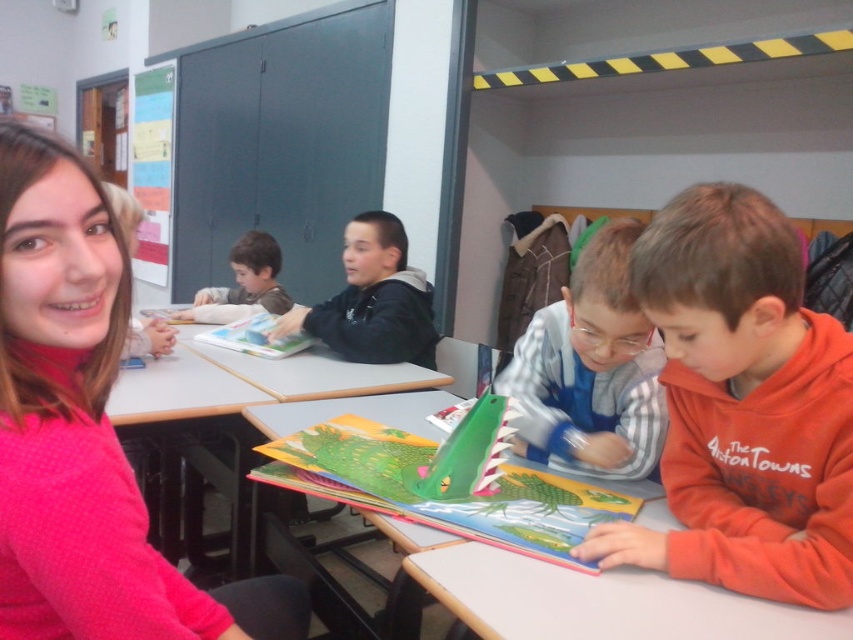
Question: Which point is farther to the camera?

Choices:
 (A) orange fleece sweatshirt at lower right
 (B) light brown hoodie at center
 (C) pink fleece sweater at upper left

Answer: (B)

Question: Which is farther from the pink fleece sweater at upper left?

Choices:
 (A) blue striped shirt at center
 (B) orange fleece sweatshirt at lower right
 (C) light brown hoodie at center

Answer: (C)

Question: Which point is farther to the camera?

Choices:
 (A) blue striped shirt at center
 (B) light brown hoodie at center

Answer: (B)

Question: Can you confirm if blue striped shirt at center is positioned below dark blue hoodie at center?

Choices:
 (A) no
 (B) yes

Answer: (B)

Question: Does light brown hoodie at center appear on the left side of hardcover book at center?

Choices:
 (A) no
 (B) yes

Answer: (B)

Question: Is orange fleece sweatshirt at lower right above matte plastic table at left?

Choices:
 (A) no
 (B) yes

Answer: (B)